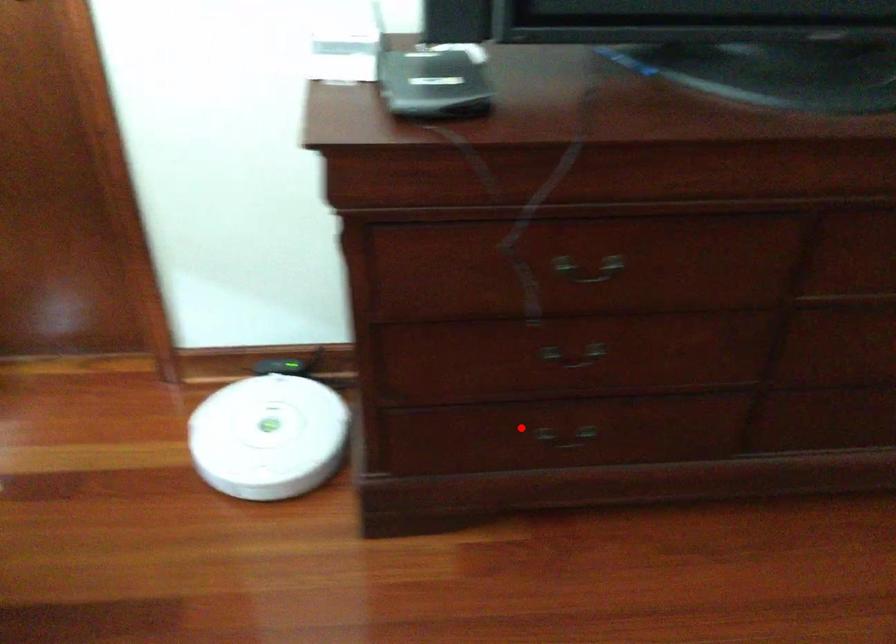
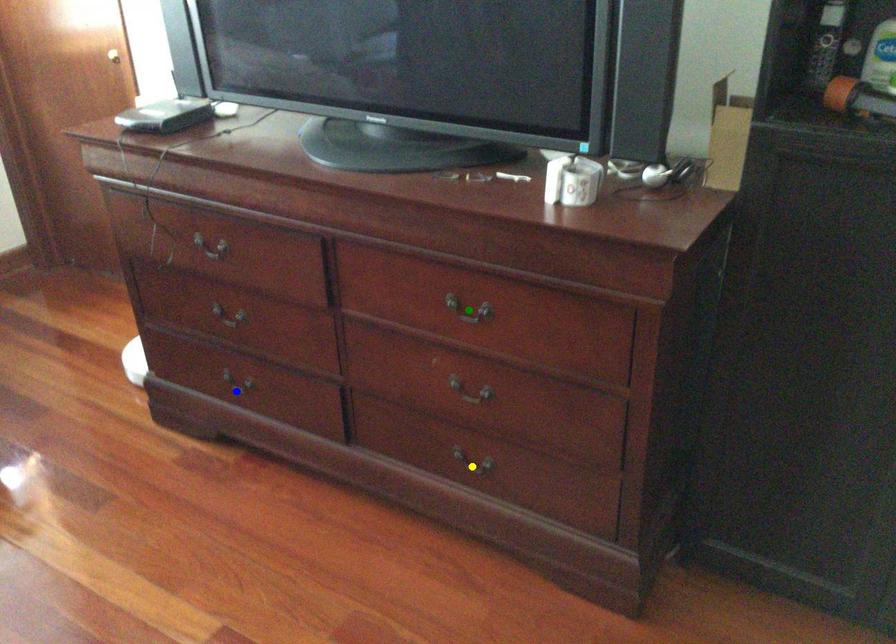
Question: I am providing you with two images of the same scene from different viewpoints. A red point is marked on the first image. You are given multiple points on the second image. Can you choose the point in image 2 that corresponds to the point in image 1?

Choices:
 (A) blue point
 (B) green point
 (C) yellow point

Answer: (A)